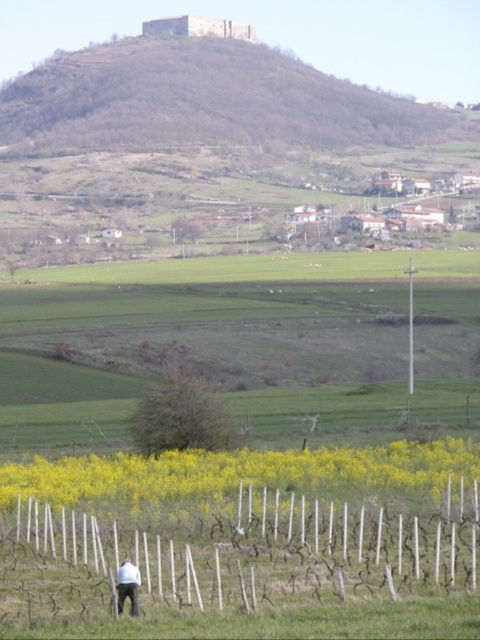
Who is positioned more to the left, bare earth hillside at upper center or dark blue jeans at lower center?

From the viewer's perspective, bare earth hillside at upper center appears more on the left side.

Can you confirm if bare earth hillside at upper center is positioned to the left of dark blue jeans at lower center?

Indeed, bare earth hillside at upper center is positioned on the left side of dark blue jeans at lower center.

Between point (27, 108) and point (136, 588), which one is positioned behind?

The point (27, 108) is behind.

Locate an element on the screen. This screenshot has width=480, height=640. bare earth hillside at upper center is located at coordinates (204, 100).

Is bare earth hillside at upper center smaller than yellow matte mustard at lower center?

No.

Between point (230, 58) and point (310, 452), which one is positioned in front?

Point (310, 452)

Identify the location of bare earth hillside at upper center. The width and height of the screenshot is (480, 640). (204, 100).

The width and height of the screenshot is (480, 640). Find the location of `bare earth hillside at upper center`. bare earth hillside at upper center is located at coordinates (204, 100).

Can you confirm if yellow matte mustard at lower center is shorter than dark blue jeans at lower center?

Result: No.

Does yellow matte mustard at lower center appear under dark blue jeans at lower center?

Yes.

Is point (137, 508) closer to viewer compared to point (118, 577)?

That is False.

Identify the location of yellow matte mustard at lower center. (243, 476).